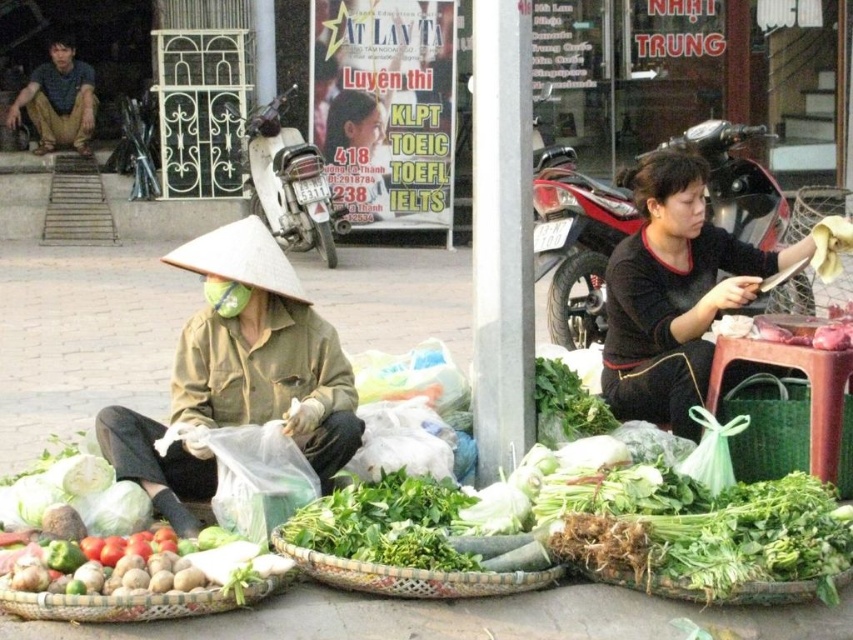
Question: Which object is closer to the camera taking this photo?

Choices:
 (A) black matte shirt at center
 (B) brown woven basket at lower left
 (C) green woven basket at right

Answer: (B)

Question: In this image, where is bamboo woven basket at center located relative to matte brown shirt at upper left?

Choices:
 (A) below
 (B) above

Answer: (A)

Question: Estimate the real-world distances between objects in this image. Which object is closer to the green woven basket at right?

Choices:
 (A) black matte shirt at center
 (B) brown woven basket at lower left
 (C) green woven basket at lower right

Answer: (A)

Question: Which of the following is the closest to the observer?

Choices:
 (A) (59, 61)
 (B) (698, 362)
 (C) (183, 608)

Answer: (C)

Question: Where is bamboo woven basket at center located in relation to green woven basket at right in the image?

Choices:
 (A) above
 (B) below

Answer: (B)

Question: Is green woven basket at lower right closer to camera compared to matte brown shirt at upper left?

Choices:
 (A) yes
 (B) no

Answer: (A)